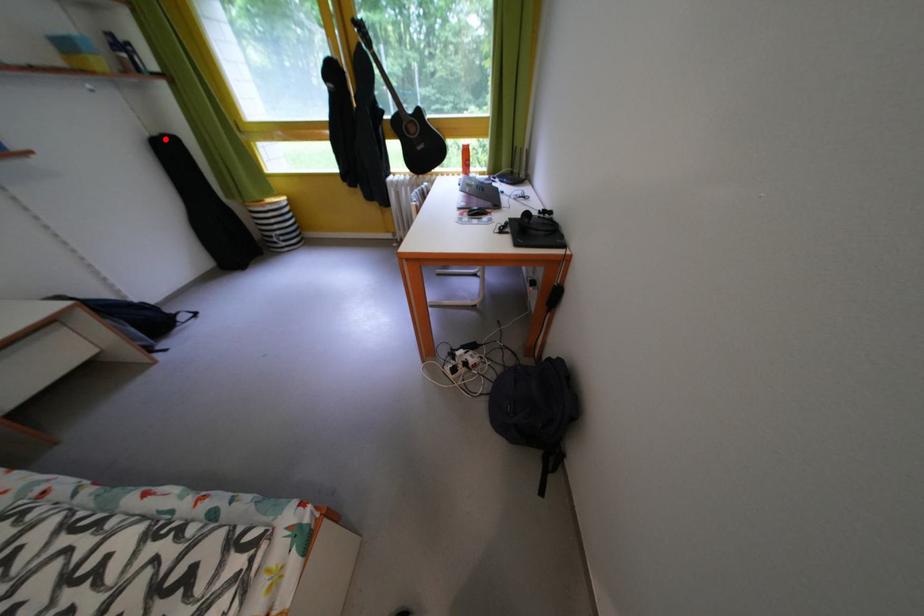
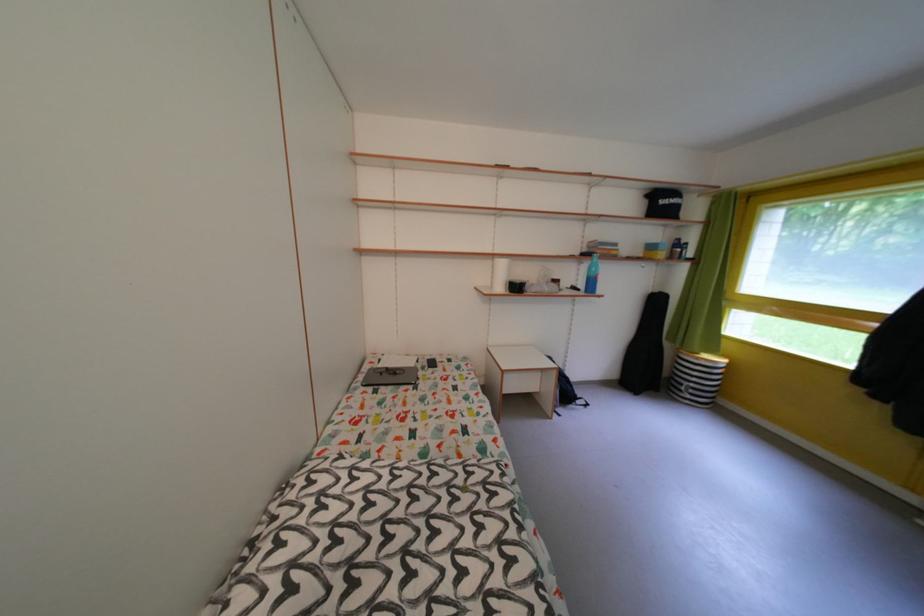
Locate, in the second image, the point that corresponds to the highlighted location in the first image.

(665, 296)